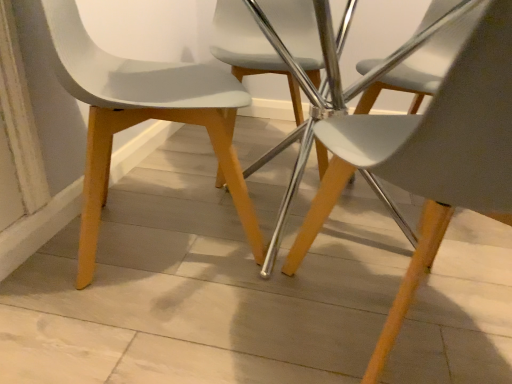
At what (x,y) coordinates should I click in order to perform the action: click on white matte plastic chair at center, the 3th chair when ordered from back to front. Please return your answer as a coordinate pair (x, y). The width and height of the screenshot is (512, 384). Looking at the image, I should click on (430, 157).

Identify the location of matte white chair at center, which is the 1th chair in back-to-front order. (248, 48).

Does white matte plastic chair at center, the 3th chair when ordered from back to front, have a lesser width compared to matte white chair at left, placed as the second chair when sorted from back to front?

Yes, white matte plastic chair at center, the 3th chair when ordered from back to front, is thinner than matte white chair at left, placed as the second chair when sorted from back to front.

Who is more distant, white matte plastic chair at center, the 1th chair in the front-to-back sequence, or matte white chair at left, arranged as the second chair when viewed from the front?

matte white chair at left, arranged as the second chair when viewed from the front, is more distant.

Who is bigger, white matte plastic chair at center, the 1th chair in the front-to-back sequence, or matte white chair at left, arranged as the second chair when viewed from the front?

white matte plastic chair at center, the 1th chair in the front-to-back sequence, is bigger.

Could you tell me if white matte plastic chair at center, the 3th chair when ordered from back to front, is turned towards matte white chair at left, arranged as the second chair when viewed from the front?

No, white matte plastic chair at center, the 3th chair when ordered from back to front, is not turned towards matte white chair at left, arranged as the second chair when viewed from the front.

Starting from the matte white chair at left, arranged as the second chair when viewed from the front, which chair is the 1st one to the right? Please provide its 2D coordinates.

[(248, 48)]

In terms of size, does matte white chair at left, arranged as the second chair when viewed from the front, appear bigger or smaller than matte white chair at center, the 3th chair when ordered from front to back?

In the image, matte white chair at left, arranged as the second chair when viewed from the front, appears to be larger than matte white chair at center, the 3th chair when ordered from front to back.

From a real-world perspective, is matte white chair at left, arranged as the second chair when viewed from the front, beneath matte white chair at center, the 3th chair when ordered from front to back?

No, from a real-world perspective, matte white chair at left, arranged as the second chair when viewed from the front, is not under matte white chair at center, the 3th chair when ordered from front to back.

Is matte white chair at left, arranged as the second chair when viewed from the front, located outside white matte plastic chair at center, the 1th chair in the front-to-back sequence?

Yes, matte white chair at left, arranged as the second chair when viewed from the front, is not within white matte plastic chair at center, the 1th chair in the front-to-back sequence.

Looking at the image, does matte white chair at left, placed as the second chair when sorted from back to front, seem bigger or smaller compared to white matte plastic chair at center, the 3th chair when ordered from back to front?

matte white chair at left, placed as the second chair when sorted from back to front, is smaller than white matte plastic chair at center, the 3th chair when ordered from back to front.

From the white matte plastic chair at center, the 1th chair in the front-to-back sequence, count 1st chairs backward and point to it. Please provide its 2D coordinates.

[(141, 115)]

Is white matte plastic chair at center, the 3th chair when ordered from back to front, looking in the opposite direction of matte white chair at center, the 3th chair when ordered from front to back?

No, white matte plastic chair at center, the 3th chair when ordered from back to front,'s orientation is not away from matte white chair at center, the 3th chair when ordered from front to back.

There is a matte white chair at center, which is the 1th chair in back-to-front order. At what (x,y) coordinates should I click in order to perform the action: click on the 2nd chair above it (from a real-world perspective). Please return your answer as a coordinate pair (x, y). The height and width of the screenshot is (384, 512). Looking at the image, I should click on (430, 157).

From the image's perspective, does white matte plastic chair at center, the 1th chair in the front-to-back sequence, appear higher than matte white chair at center, the 3th chair when ordered from front to back?

No.

Which object is further away from the camera taking this photo, white matte plastic chair at center, the 3th chair when ordered from back to front, or matte white chair at center, the 3th chair when ordered from front to back?

matte white chair at center, the 3th chair when ordered from front to back, is behind.

Does point (301, 28) lie behind point (94, 194)?

Yes, it is behind point (94, 194).

Can you confirm if matte white chair at center, the 3th chair when ordered from front to back, is wider than matte white chair at left, placed as the second chair when sorted from back to front?

Incorrect, the width of matte white chair at center, the 3th chair when ordered from front to back, does not surpass that of matte white chair at left, placed as the second chair when sorted from back to front.

Who is shorter, matte white chair at center, which is the 1th chair in back-to-front order, or matte white chair at left, placed as the second chair when sorted from back to front?

Standing shorter between the two is matte white chair at center, which is the 1th chair in back-to-front order.

Is matte white chair at center, which is the 1th chair in back-to-front order, outside of matte white chair at left, placed as the second chair when sorted from back to front?

Yes.

How different are the orientations of matte white chair at center, the 3th chair when ordered from front to back, and white matte plastic chair at center, the 1th chair in the front-to-back sequence, in degrees?

The angle between the facing direction of matte white chair at center, the 3th chair when ordered from front to back, and the facing direction of white matte plastic chair at center, the 1th chair in the front-to-back sequence, is 179 degrees.

Which is more to the left, matte white chair at center, which is the 1th chair in back-to-front order, or white matte plastic chair at center, the 1th chair in the front-to-back sequence?

From the viewer's perspective, matte white chair at center, which is the 1th chair in back-to-front order, appears more on the left side.

Is matte white chair at center, which is the 1th chair in back-to-front order, facing away from white matte plastic chair at center, the 1th chair in the front-to-back sequence?

matte white chair at center, which is the 1th chair in back-to-front order, does not have its back to white matte plastic chair at center, the 1th chair in the front-to-back sequence.

Is white matte plastic chair at center, the 1th chair in the front-to-back sequence, located within matte white chair at center, the 3th chair when ordered from front to back?

No, white matte plastic chair at center, the 1th chair in the front-to-back sequence, is not inside matte white chair at center, the 3th chair when ordered from front to back.

I want to click on chair that appears in front of the matte white chair at left, arranged as the second chair when viewed from the front, so click(430, 157).

The width and height of the screenshot is (512, 384). I want to click on chair lying on the left of matte white chair at center, the 3th chair when ordered from front to back, so click(141, 115).

Estimate the real-world distances between objects in this image. Which object is closer to matte white chair at left, placed as the second chair when sorted from back to front, matte white chair at center, the 3th chair when ordered from front to back, or white matte plastic chair at center, the 1th chair in the front-to-back sequence?

white matte plastic chair at center, the 1th chair in the front-to-back sequence.

Based on their spatial positions, is matte white chair at left, arranged as the second chair when viewed from the front, or white matte plastic chair at center, the 3th chair when ordered from back to front, closer to matte white chair at center, the 3th chair when ordered from front to back?

matte white chair at left, arranged as the second chair when viewed from the front, lies closer to matte white chair at center, the 3th chair when ordered from front to back, than the other object.

Consider the image. From the image, which object appears to be nearer to matte white chair at center, the 3th chair when ordered from front to back, white matte plastic chair at center, the 3th chair when ordered from back to front, or matte white chair at left, arranged as the second chair when viewed from the front?

Based on the image, matte white chair at left, arranged as the second chair when viewed from the front, appears to be nearer to matte white chair at center, the 3th chair when ordered from front to back.

From the image, which object appears to be nearer to matte white chair at left, arranged as the second chair when viewed from the front, white matte plastic chair at center, the 1th chair in the front-to-back sequence, or matte white chair at center, which is the 1th chair in back-to-front order?

white matte plastic chair at center, the 1th chair in the front-to-back sequence.

Considering their positions, is matte white chair at left, arranged as the second chair when viewed from the front, positioned closer to white matte plastic chair at center, the 1th chair in the front-to-back sequence, than matte white chair at center, which is the 1th chair in back-to-front order?

matte white chair at left, arranged as the second chair when viewed from the front, is positioned closer to the anchor white matte plastic chair at center, the 1th chair in the front-to-back sequence.

From the image, which object appears to be farther from white matte plastic chair at center, the 1th chair in the front-to-back sequence, matte white chair at center, which is the 1th chair in back-to-front order, or matte white chair at left, arranged as the second chair when viewed from the front?

Among the two, matte white chair at center, which is the 1th chair in back-to-front order, is located further to white matte plastic chair at center, the 1th chair in the front-to-back sequence.

At what (x,y) coordinates should I click in order to perform the action: click on chair positioned between white matte plastic chair at center, the 1th chair in the front-to-back sequence, and matte white chair at center, the 3th chair when ordered from front to back, from near to far. Please return your answer as a coordinate pair (x, y). Image resolution: width=512 pixels, height=384 pixels. Looking at the image, I should click on (141, 115).